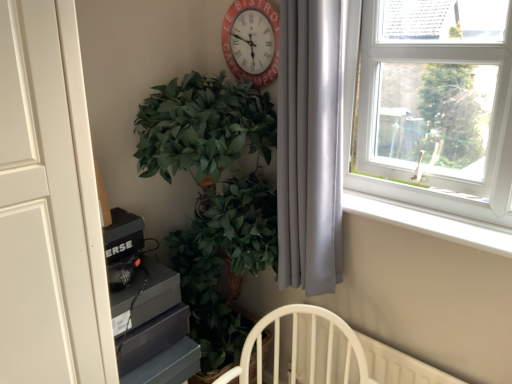
Measure the distance between white plastic window at upper right and camera.

white plastic window at upper right is 4.13 feet away from camera.

Image resolution: width=512 pixels, height=384 pixels. Describe the element at coordinates (310, 146) in the screenshot. I see `silky gray curtain at right` at that location.

You are a GUI agent. You are given a task and a screenshot of the screen. Output one action in this format:
    pyautogui.click(x=<x>, y=<y>)
    Task: Click on the green leafy plant at center-left
    The image size is (512, 384).
    Given the screenshot: What is the action you would take?
    pyautogui.click(x=214, y=195)

Is white plastic window sill at upper right wider or thinner than silky gray curtain at right?

Considering their sizes, white plastic window sill at upper right looks slimmer than silky gray curtain at right.

Can you tell me how much white plastic window sill at upper right and silky gray curtain at right differ in facing direction?

The angular difference between white plastic window sill at upper right and silky gray curtain at right is 8.45 degrees.

Is point (374, 198) positioned after point (285, 284)?

No.

Is white plastic window sill at upper right oriented towards silky gray curtain at right?

No, white plastic window sill at upper right is not oriented towards silky gray curtain at right.

From the image's perspective, is white plastic window sill at upper right located above or below white plastic window at upper right?

Clearly, from the image's perspective, white plastic window sill at upper right is below white plastic window at upper right.

Considering the sizes of objects white plastic window sill at upper right and white plastic window at upper right in the image provided, who is taller, white plastic window sill at upper right or white plastic window at upper right?

Standing taller between the two is white plastic window at upper right.

Relative to white plastic window at upper right, is white plastic window sill at upper right in front or behind?

Visually, white plastic window sill at upper right is located behind white plastic window at upper right.

Can you tell me how much white plastic window sill at upper right and white plastic window at upper right differ in facing direction?

1.32 degrees separate the facing orientations of white plastic window sill at upper right and white plastic window at upper right.

Is point (250, 96) positioned after point (268, 33)?

No, it is not.

From the image's perspective, between green leafy plant at center-left and red painted wood clock at upper center, who is located below?

From the image's view, green leafy plant at center-left is below.

The width and height of the screenshot is (512, 384). I want to click on wall clock behind the green leafy plant at center-left, so click(252, 41).

Consider the image. Between green leafy plant at center-left and red painted wood clock at upper center, which one is positioned behind?

red painted wood clock at upper center is behind.

Based on their sizes in the image, would you say silky gray curtain at right is bigger or smaller than green leafy plant at center-left?

Clearly, silky gray curtain at right is smaller in size than green leafy plant at center-left.

In the scene shown: Which is in front, silky gray curtain at right or green leafy plant at center-left?

green leafy plant at center-left.

Where is `houseplant below the silky gray curtain at right (from a real-world perspective)`? houseplant below the silky gray curtain at right (from a real-world perspective) is located at coordinates (214, 195).

Considering the sizes of objects silky gray curtain at right and green leafy plant at center-left in the image provided, who is shorter, silky gray curtain at right or green leafy plant at center-left?

silky gray curtain at right is shorter.

Are white plastic window sill at upper right and red painted wood clock at upper center located far from each other?

No, white plastic window sill at upper right is not far from red painted wood clock at upper center.

Where is `wall clock that is behind the white plastic window sill at upper right`? This screenshot has height=384, width=512. wall clock that is behind the white plastic window sill at upper right is located at coordinates (252, 41).

In the scene shown: From the image's perspective, is white plastic window sill at upper right above red painted wood clock at upper center?

No, from the image's perspective, white plastic window sill at upper right is not on top of red painted wood clock at upper center.

From a real-world perspective, between white plastic window sill at upper right and red painted wood clock at upper center, who is vertically higher?

From a 3D spatial view, red painted wood clock at upper center is above.

Is silky gray curtain at right completely or partially inside red painted wood clock at upper center?

No, red painted wood clock at upper center does not contain silky gray curtain at right.

Considering the positions of objects red painted wood clock at upper center and silky gray curtain at right in the image provided, who is behind, red painted wood clock at upper center or silky gray curtain at right?

red painted wood clock at upper center is further away from the camera.

Which is behind, point (241, 41) or point (292, 225)?

The point (241, 41) is behind.

Looking at this image, choose the correct answer: Is white plastic window sill at upper right inside green leafy plant at center-left or outside it?

white plastic window sill at upper right is located beyond the bounds of green leafy plant at center-left.

From a real-world perspective, is white plastic window sill at upper right below green leafy plant at center-left?

No, from a real-world perspective, white plastic window sill at upper right is not under green leafy plant at center-left.

Consider the image. Considering their positions, is white plastic window sill at upper right located in front of or behind green leafy plant at center-left?

Visually, white plastic window sill at upper right is located behind green leafy plant at center-left.

From the image's perspective, relative to green leafy plant at center-left, is white plastic window sill at upper right above or below?

Based on their image positions, white plastic window sill at upper right is located above green leafy plant at center-left.

The width and height of the screenshot is (512, 384). Identify the location of window sill below the silky gray curtain at right (from a real-world perspective). (430, 222).

The width and height of the screenshot is (512, 384). What are the coordinates of `window above the white plastic window sill at upper right (from the image's perspective)` in the screenshot? It's located at (433, 104).

From the image, which object appears to be farther from white plastic window sill at upper right, red painted wood clock at upper center or green leafy plant at center-left?

red painted wood clock at upper center is further to white plastic window sill at upper right.

Considering their positions, is white plastic window at upper right positioned further to white plastic window sill at upper right than red painted wood clock at upper center?

red painted wood clock at upper center is positioned further to the anchor white plastic window sill at upper right.

When comparing their distances from white plastic window sill at upper right, does green leafy plant at center-left or white plastic window at upper right seem closer?

white plastic window at upper right is closer to white plastic window sill at upper right.

From the image, which object appears to be farther from white plastic window sill at upper right, white plastic window at upper right or silky gray curtain at right?

The object further to white plastic window sill at upper right is silky gray curtain at right.

Looking at the image, which one is located closer to white plastic window sill at upper right, silky gray curtain at right or red painted wood clock at upper center?

silky gray curtain at right.

Looking at the image, which one is located further to white plastic window at upper right, green leafy plant at center-left or white plastic window sill at upper right?

green leafy plant at center-left is further to white plastic window at upper right.

Considering their positions, is green leafy plant at center-left positioned further to white plastic window at upper right than silky gray curtain at right?

Based on the image, green leafy plant at center-left appears to be further to white plastic window at upper right.

Which object lies further to the anchor point silky gray curtain at right, red painted wood clock at upper center or white plastic window at upper right?

red painted wood clock at upper center lies further to silky gray curtain at right than the other object.

In order to click on window sill between silky gray curtain at right and white plastic window at upper right from left to right in this screenshot , I will do `click(430, 222)`.

Locate an element on the screen. The image size is (512, 384). window between red painted wood clock at upper center and white plastic window sill at upper right from top to bottom is located at coordinates (433, 104).

This screenshot has height=384, width=512. In order to click on window sill between red painted wood clock at upper center and green leafy plant at center-left vertically in this screenshot , I will do `click(430, 222)`.

Locate an element on the screen. This screenshot has width=512, height=384. curtain between red painted wood clock at upper center and white plastic window at upper right is located at coordinates (310, 146).